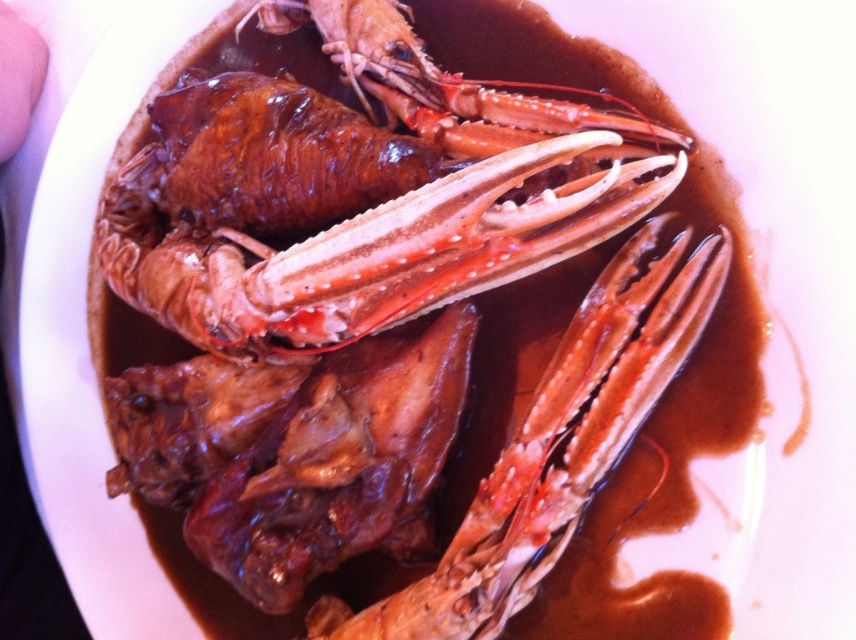
You are a food critic evaluating the presentation of this dish. The shiny brown lobster at center and the pink flesh at upper left are key elements. Which of these two elements has a greater width?

The shiny brown lobster at center has a greater width than the pink flesh at upper left.

You are a food critic who needs to describe the location of the shiny orange lobster claw at center in the image. What are its coordinates?

The shiny orange lobster claw at center is located at coordinates point (560, 442).

Looking at this image, you are a food critic examining the seafood dish. From your perspective, which object is closer to you between the shiny brown crab at center and the pink flesh at upper left?

The shiny brown crab at center is closer to you because it is in front of the pink flesh at upper left.